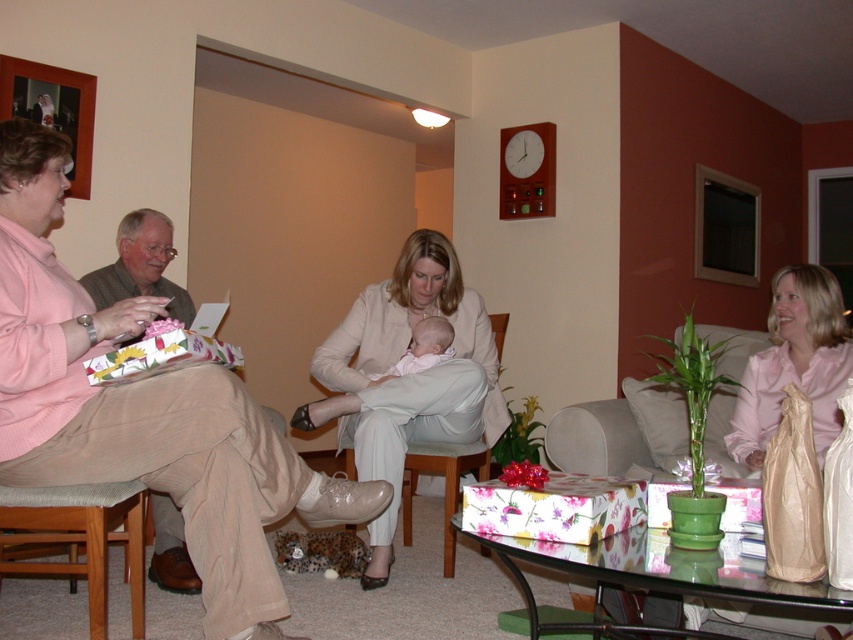
Question: Is matte pink sweater at left positioned behind pink satin blouse at center?

Choices:
 (A) yes
 (B) no

Answer: (B)

Question: Which of the following is the farthest from the observer?

Choices:
 (A) matte pink sweater at left
 (B) matte white coat at center
 (C) pink satin blouse at center

Answer: (B)

Question: Which point appears farthest from the camera in this image?

Choices:
 (A) (112, 458)
 (B) (839, 369)
 (C) (445, 342)
 (D) (363, 394)

Answer: (C)

Question: Which object appears closest to the camera in this image?

Choices:
 (A) matte white coat at center
 (B) pink satin blouse at center
 (C) matte pink sweater at left
 (D) soft white baby at center

Answer: (C)

Question: Is matte pink sweater at left closer to the viewer compared to pink satin blouse at center?

Choices:
 (A) yes
 (B) no

Answer: (A)

Question: Is matte pink sweater at left further to the viewer compared to soft white baby at center?

Choices:
 (A) no
 (B) yes

Answer: (A)